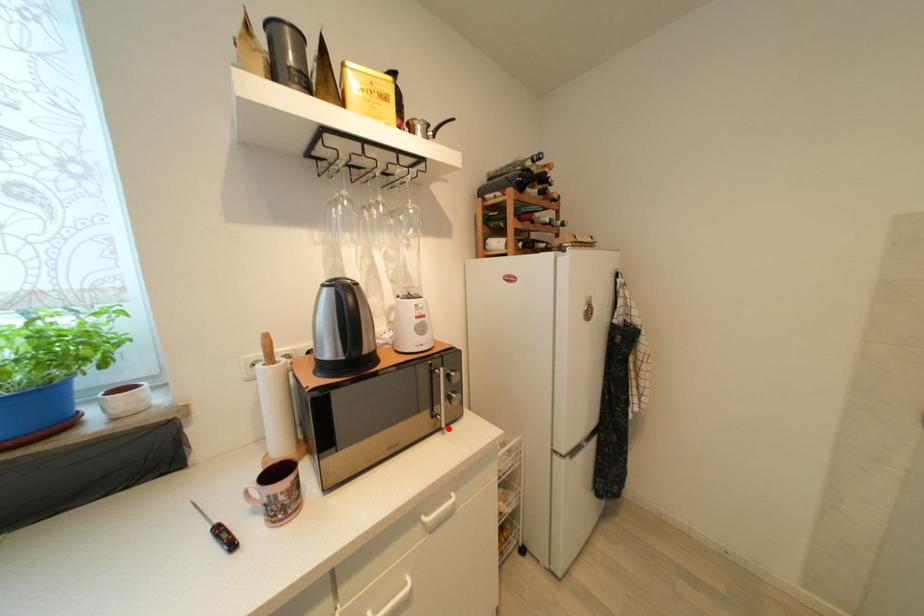
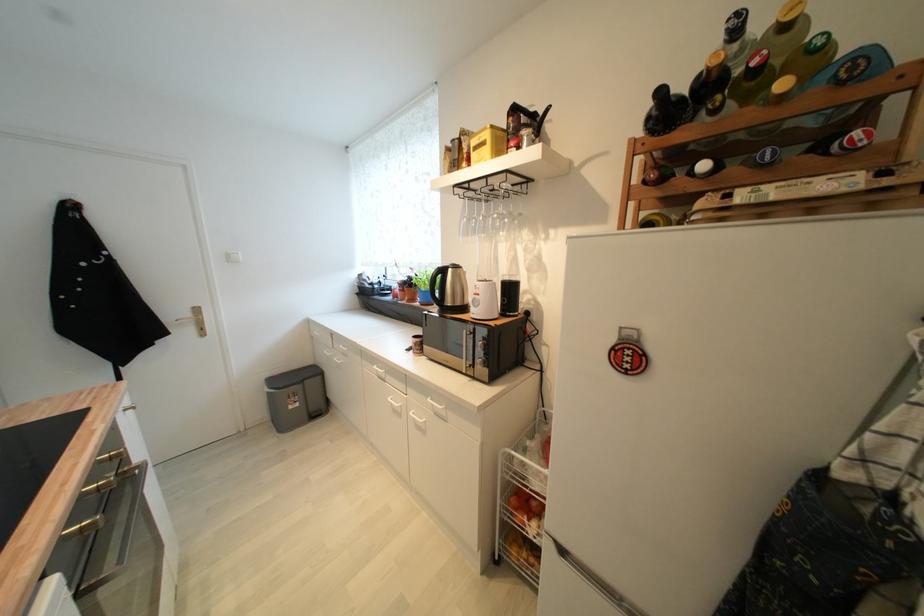
In the second image, find the point that corresponds to the highlighted location in the first image.

(469, 374)